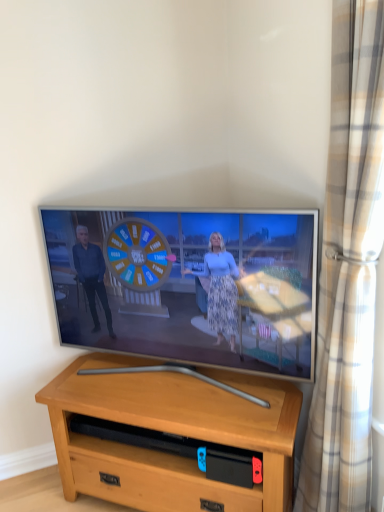
Question: From the image's perspective, is flat screen tv at center over beige plaid curtain at right?

Choices:
 (A) yes
 (B) no

Answer: (A)

Question: Is flat screen tv at center further to camera compared to beige plaid curtain at right?

Choices:
 (A) yes
 (B) no

Answer: (A)

Question: Does flat screen tv at center have a smaller size compared to beige plaid curtain at right?

Choices:
 (A) yes
 (B) no

Answer: (B)

Question: Considering the relative sizes of flat screen tv at center and beige plaid curtain at right in the image provided, is flat screen tv at center wider than beige plaid curtain at right?

Choices:
 (A) yes
 (B) no

Answer: (A)

Question: Can you confirm if flat screen tv at center is thinner than beige plaid curtain at right?

Choices:
 (A) yes
 (B) no

Answer: (B)

Question: Does flat screen tv at center lie in front of beige plaid curtain at right?

Choices:
 (A) no
 (B) yes

Answer: (A)

Question: Is light brown wood desk at center not within flat screen tv at center?

Choices:
 (A) yes
 (B) no

Answer: (A)

Question: Does light brown wood desk at center have a smaller size compared to flat screen tv at center?

Choices:
 (A) no
 (B) yes

Answer: (A)

Question: Is light brown wood desk at center at the right side of flat screen tv at center?

Choices:
 (A) yes
 (B) no

Answer: (A)

Question: From the image's perspective, is light brown wood desk at center on top of flat screen tv at center?

Choices:
 (A) yes
 (B) no

Answer: (B)

Question: Does light brown wood desk at center contain flat screen tv at center?

Choices:
 (A) yes
 (B) no

Answer: (B)

Question: Is light brown wood desk at center aimed at flat screen tv at center?

Choices:
 (A) yes
 (B) no

Answer: (B)

Question: Considering the relative sizes of light brown wood desk at center and beige plaid curtain at right in the image provided, is light brown wood desk at center shorter than beige plaid curtain at right?

Choices:
 (A) no
 (B) yes

Answer: (B)